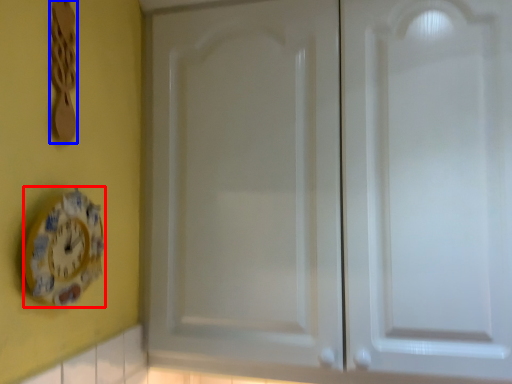
Question: Which object is further to the camera taking this photo, clock (highlighted by a red box) or spoon (highlighted by a blue box)?

Choices:
 (A) clock
 (B) spoon

Answer: (B)